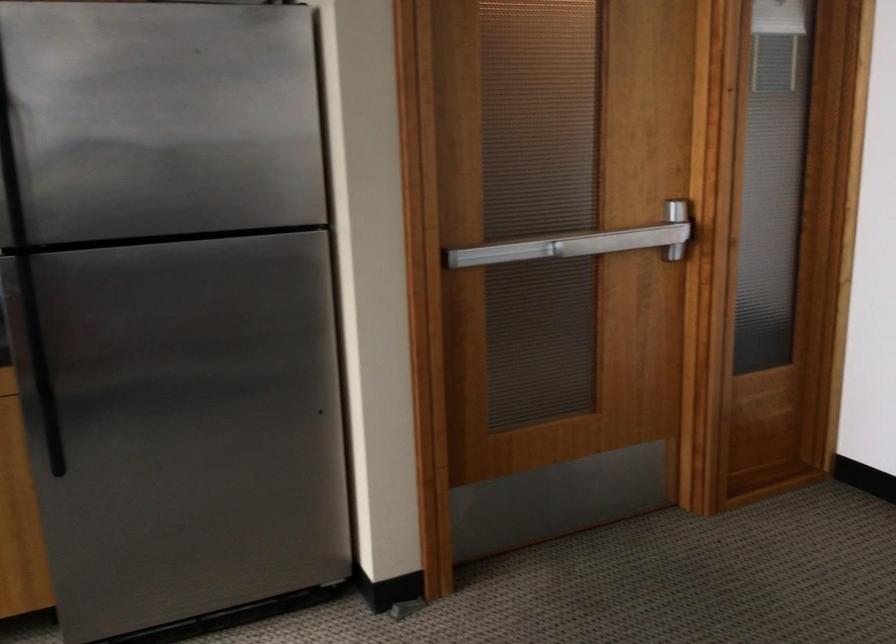
Where is `metal door push bar`? The image size is (896, 644). metal door push bar is located at coordinates (583, 243).